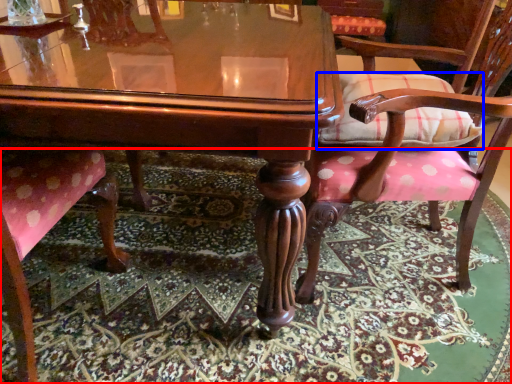
Question: Which object is further to the camera taking this photo, mat (highlighted by a red box) or pillow (highlighted by a blue box)?

Choices:
 (A) mat
 (B) pillow

Answer: (B)